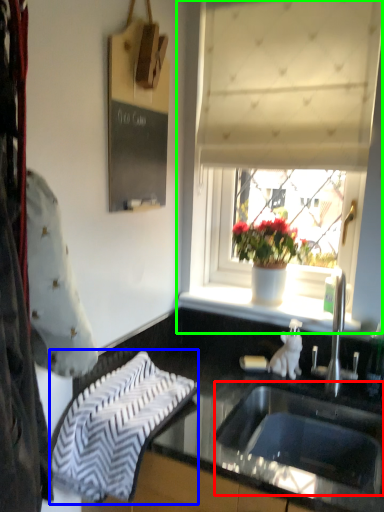
Question: Considering the real-world distances, which object is closest to sink (highlighted by a red box)? beach towel (highlighted by a blue box) or window (highlighted by a green box).

Choices:
 (A) beach towel
 (B) window

Answer: (A)